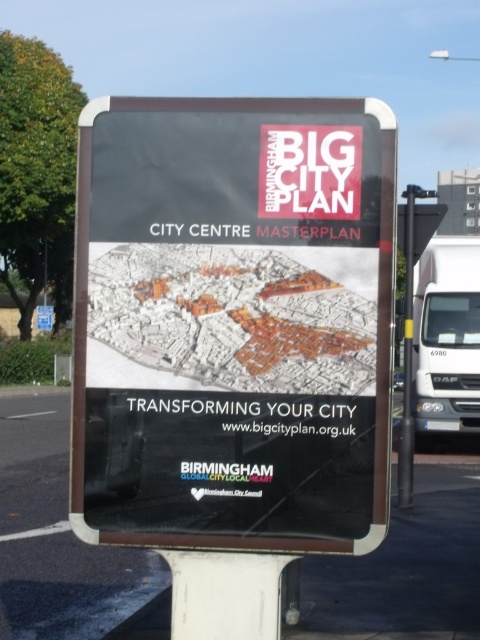
You are a city planner standing in front of the Birmingham Big City Plan signboard. You notice two poles on the right side of the signboard. Which pole is positioned further to the right between the metallic pole at right and the white plastic pole at right?

The metallic pole at right is positioned further to the right compared to the white plastic pole at right.

You are a city planner who needs to install a new information board that is 2 meters tall. You are standing in front of the matte black sign at center and the white plastic pole at right. Which object is shorter than your new board?

The matte black sign at center is not as tall as the white plastic pole at right. Since the new board is 2 meters tall, the matte black sign at center is shorter than the new board.

You are a city planner looking at the Birmingham Big City Plan signboard. You see a point marked at coordinates (411, 316) on the map. What object on the signboard does this point correspond to?

The point at coordinates (411, 316) corresponds to the metallic pole at right.